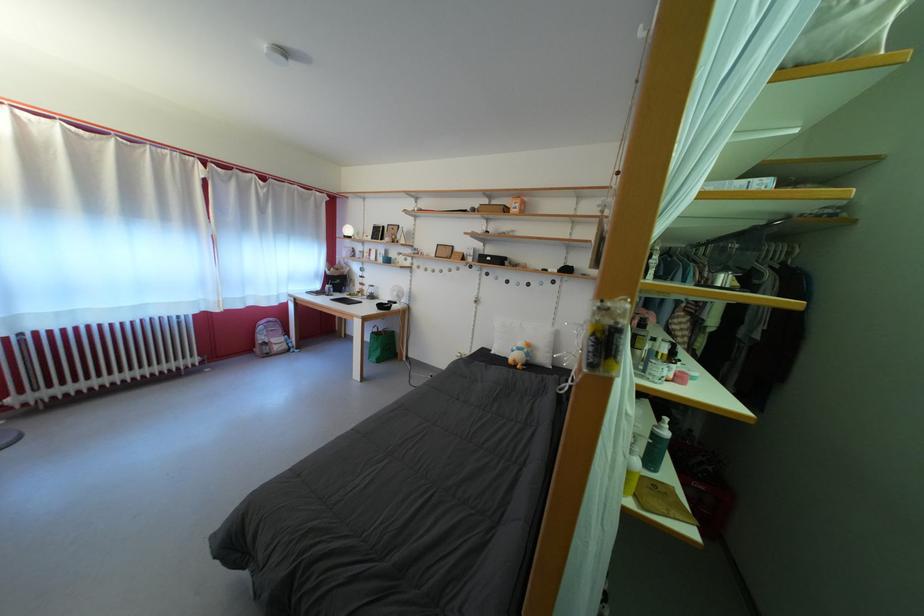
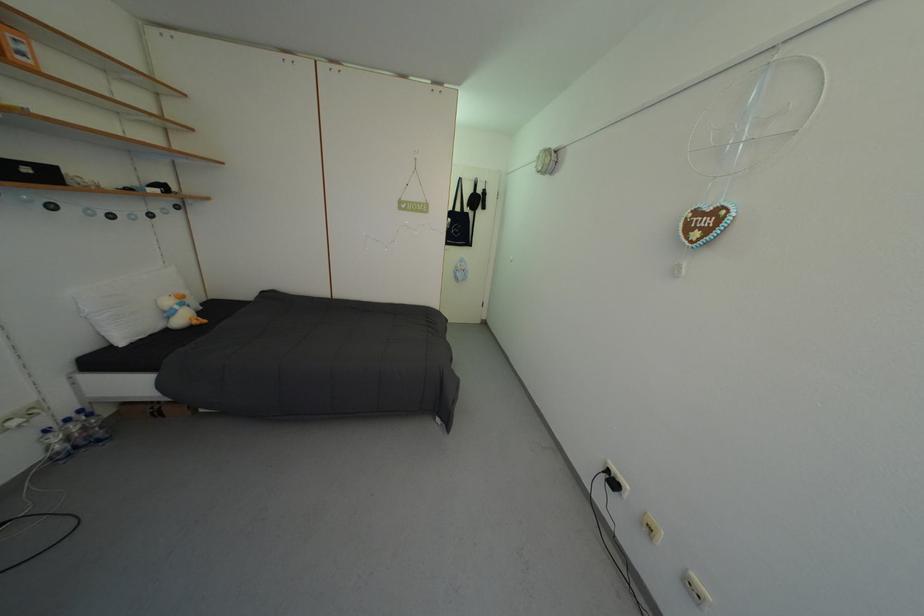
The point at (496, 265) is marked in the first image. Where is the corresponding point in the second image?

(35, 176)